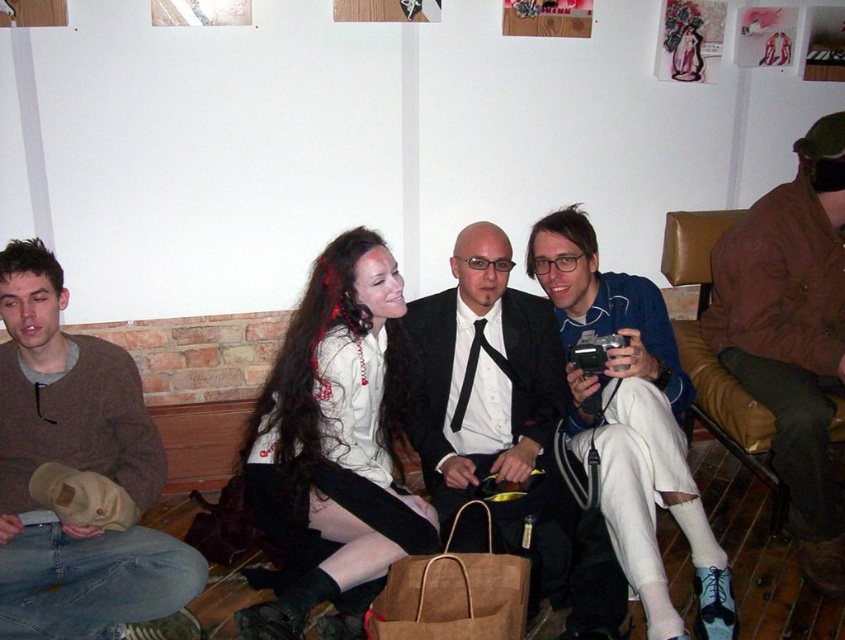
Can you confirm if white satin blouse at center is positioned to the right of brown corduroy jacket at right?

Incorrect, white satin blouse at center is not on the right side of brown corduroy jacket at right.

Does point (244, 624) come behind point (838, 387)?

No.

Locate an element on the screen. This screenshot has width=845, height=640. white satin blouse at center is located at coordinates (333, 445).

Can you confirm if brown sweater at left is positioned below matte black suit at center?

Yes, brown sweater at left is below matte black suit at center.

Can you confirm if brown sweater at left is thinner than matte black suit at center?

In fact, brown sweater at left might be wider than matte black suit at center.

Identify the location of brown sweater at left. (78, 468).

Who is more distant from viewer, [335,326] or [655,586]?

The point [335,326] is behind.

Is point (396, 284) closer to camera compared to point (645, 289)?

Yes, point (396, 284) is in front of point (645, 289).

Describe the element at coordinates (333, 445) in the screenshot. I see `white satin blouse at center` at that location.

I want to click on white satin blouse at center, so click(333, 445).